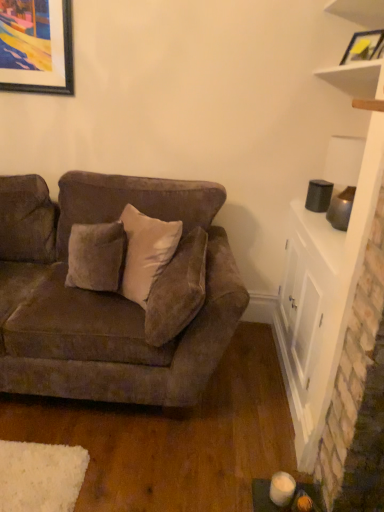
Question: From the image's perspective, is matte yellow picture frame at upper right located above or below suede brown couch at center?

Choices:
 (A) below
 (B) above

Answer: (B)

Question: Considering the relative positions of matte yellow picture frame at upper right and suede brown couch at center in the image provided, is matte yellow picture frame at upper right to the left or to the right of suede brown couch at center?

Choices:
 (A) left
 (B) right

Answer: (B)

Question: Estimate the real-world distances between objects in this image. Which object is farther from the white matte shelf at upper right?

Choices:
 (A) suede brown couch at center
 (B) matte yellow picture frame at upper right
 (C) white glossy cabinet at right
 (D) suede-like beige pillow at center

Answer: (A)

Question: Based on their relative distances, which object is farther from the matte yellow picture frame at upper right?

Choices:
 (A) suede-like beige pillow at center
 (B) white matte shelf at upper right
 (C) white glossy cabinet at right
 (D) suede brown couch at center

Answer: (D)